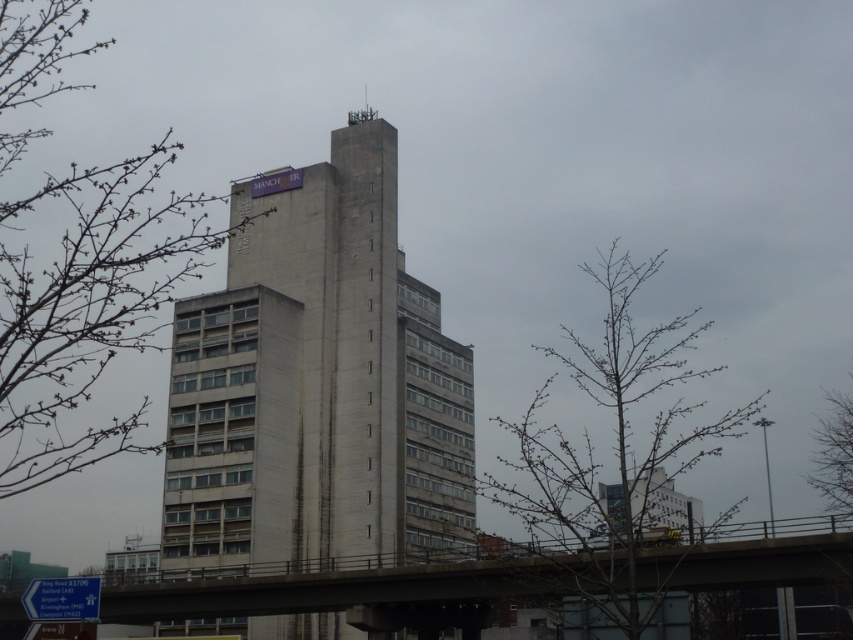
Based on the photo, you are a drone operator tasked with flying a drone from the concrete bridge at lower center to the bare branches at center. The drone has a maximum flight range of 50 meters. Can the drone complete this journey without needing to recharge?

The distance between the concrete bridge at lower center and the bare branches at center is 52.96 meters, which exceeds the drone operator stated maximum flight range of 50 meters. Therefore, the drone cannot complete the journey without recharging.

You are a bird looking for a place to land. You see the bare branches at center and the concrete bridge at lower center. Which one is wider for you to land on?

The bare branches at center might be wider than the concrete bridge at lower center, so the bare branches at center could be a better option for landing.

You are an urban planner assessing the view from the building. Which of the two bare branches, the bare branches at upper left or the bare branches at center, would block more of the building facade when viewed from the street below?

The bare branches at upper left would block more of the building facade because they are wider than the bare branches at center.